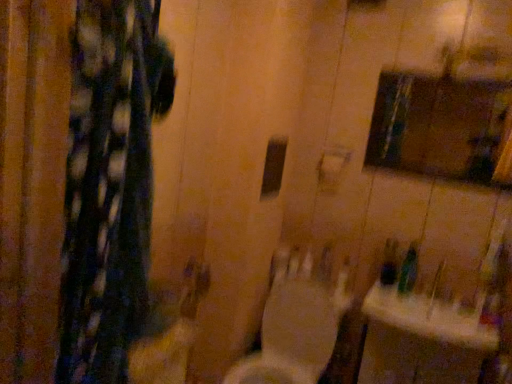
Question: Does matte glass medicine cabinet at upper right have a greater height compared to white glossy sink at lower right?

Choices:
 (A) no
 (B) yes

Answer: (B)

Question: Can you confirm if matte glass medicine cabinet at upper right is smaller than white glossy sink at lower right?

Choices:
 (A) yes
 (B) no

Answer: (A)

Question: Does matte glass medicine cabinet at upper right come behind white glossy sink at lower right?

Choices:
 (A) no
 (B) yes

Answer: (B)

Question: Is matte glass medicine cabinet at upper right positioned in front of white glossy sink at lower right?

Choices:
 (A) no
 (B) yes

Answer: (A)

Question: Can you confirm if matte glass medicine cabinet at upper right is bigger than white glossy sink at lower right?

Choices:
 (A) yes
 (B) no

Answer: (B)

Question: From a real-world perspective, relative to white glossy sink at lower right, is white glossy toilet at center vertically above or below?

Choices:
 (A) above
 (B) below

Answer: (B)

Question: In the image, is white glossy toilet at center on the left side or the right side of white glossy sink at lower right?

Choices:
 (A) right
 (B) left

Answer: (B)

Question: Is white glossy toilet at center spatially inside white glossy sink at lower right, or outside of it?

Choices:
 (A) outside
 (B) inside

Answer: (A)

Question: In terms of width, does white glossy toilet at center look wider or thinner when compared to white glossy sink at lower right?

Choices:
 (A) thin
 (B) wide

Answer: (B)

Question: Is matte glass medicine cabinet at upper right in front of or behind white glossy sink at lower right in the image?

Choices:
 (A) behind
 (B) front

Answer: (A)

Question: From a real-world perspective, relative to white glossy sink at lower right, is matte glass medicine cabinet at upper right vertically above or below?

Choices:
 (A) below
 (B) above

Answer: (B)

Question: From the image's perspective, is matte glass medicine cabinet at upper right located above or below white glossy sink at lower right?

Choices:
 (A) above
 (B) below

Answer: (A)

Question: Is point (475, 152) closer or farther from the camera than point (413, 322)?

Choices:
 (A) farther
 (B) closer

Answer: (A)

Question: Is white glossy sink at lower right situated inside green plastic bottle at lower right or outside?

Choices:
 (A) inside
 (B) outside

Answer: (B)

Question: From the image's perspective, is white glossy sink at lower right positioned above or below green plastic bottle at lower right?

Choices:
 (A) below
 (B) above

Answer: (A)